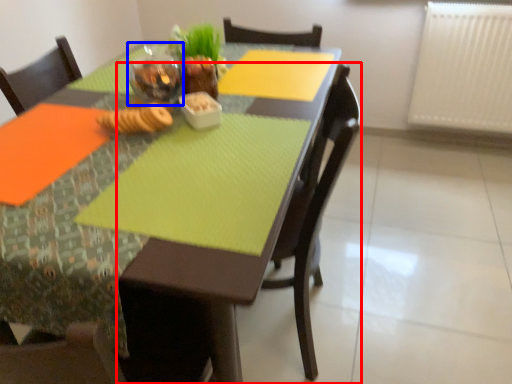
Question: Which object is further to the camera taking this photo, chair (highlighted by a red box) or tableware (highlighted by a blue box)?

Choices:
 (A) chair
 (B) tableware

Answer: (B)